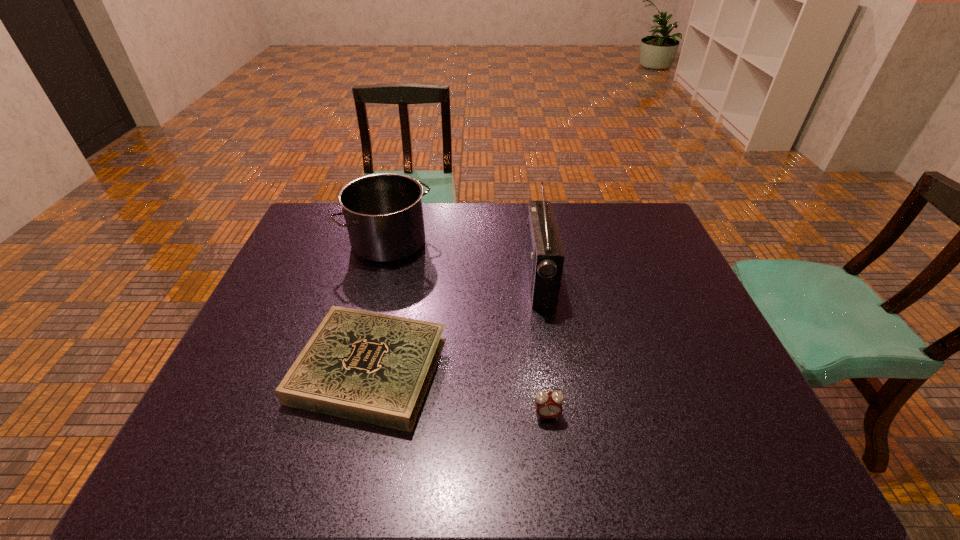
You are a GUI agent. You are given a task and a screenshot of the screen. Output one action in this format:
    pyautogui.click(x=<x>, y=<y>)
    Task: Click on the free location that satisfies the following two spatial constraints: 1. on the front-facing side of the tallest object; 2. on the front side of the shortest object
    The height and width of the screenshot is (540, 960).
    Given the screenshot: What is the action you would take?
    pyautogui.click(x=553, y=369)

This screenshot has width=960, height=540. Find the location of `blank space that satisfies the following two spatial constraints: 1. on the front-facing side of the tallest object; 2. on the clock face of the alarm clock`. blank space that satisfies the following two spatial constraints: 1. on the front-facing side of the tallest object; 2. on the clock face of the alarm clock is located at coordinates (561, 415).